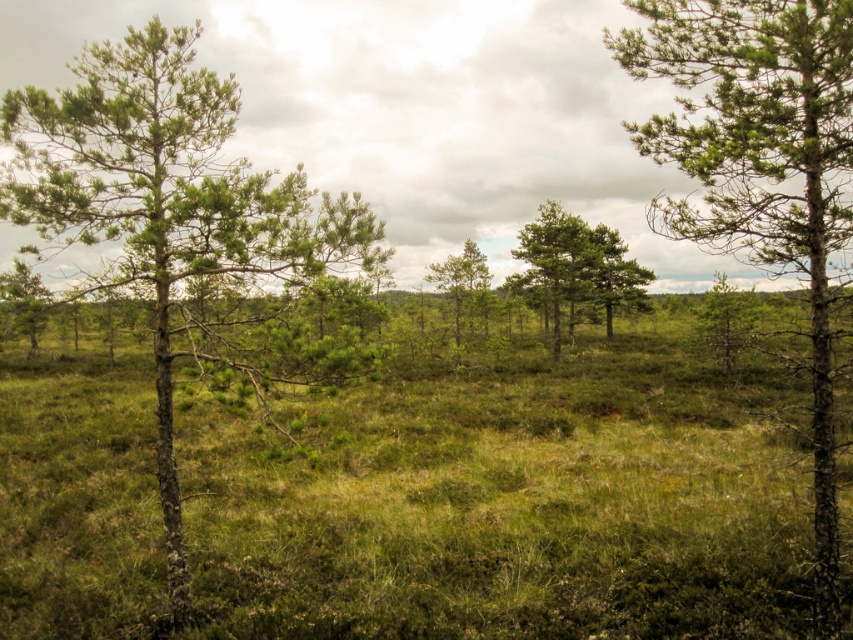
You are standing in the bog and want to walk towards the green textured tree at center. Which direction should you walk to avoid the green rough bark tree at left?

To avoid the green rough bark tree at left, you should walk towards the center of the bog, moving away from the green rough bark tree at left which is closer to you, towards the green textured tree at center located further ahead.

You are standing in the bog and want to walk from the green rough bark tree at left to the green textured tree at center. Which direction should you head?

You should head to the right because the green rough bark tree at left is located to the left of the green textured tree at center.